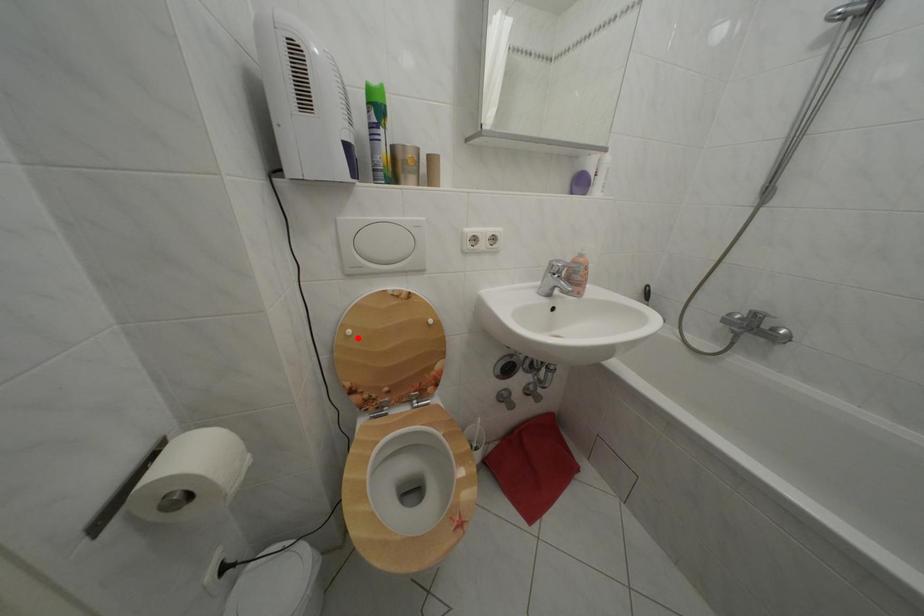
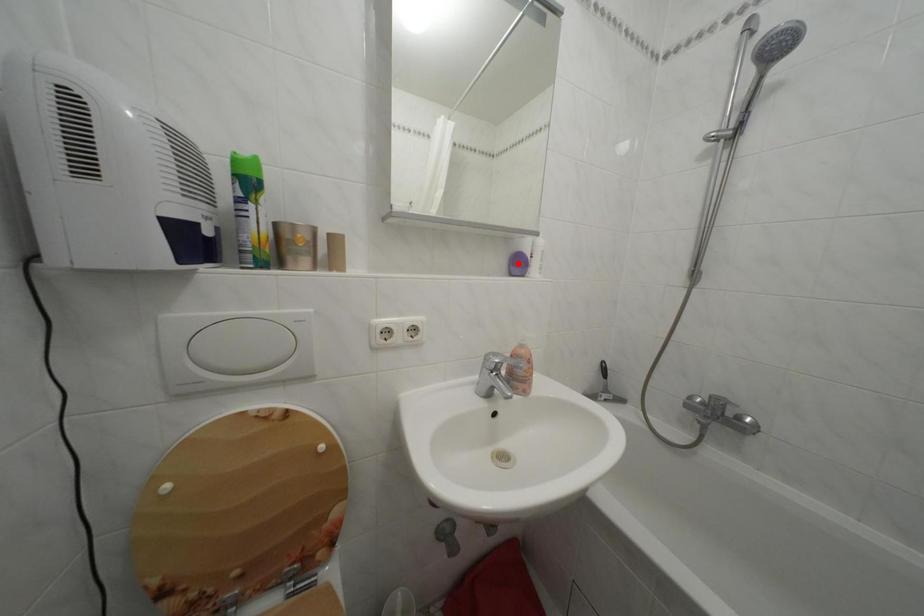
I am providing you with two images of the same scene from different viewpoints. A red point is marked on the first image and another point is marked on the second image. Do the highlighted points in image1 and image2 indicate the same real-world spot?

No